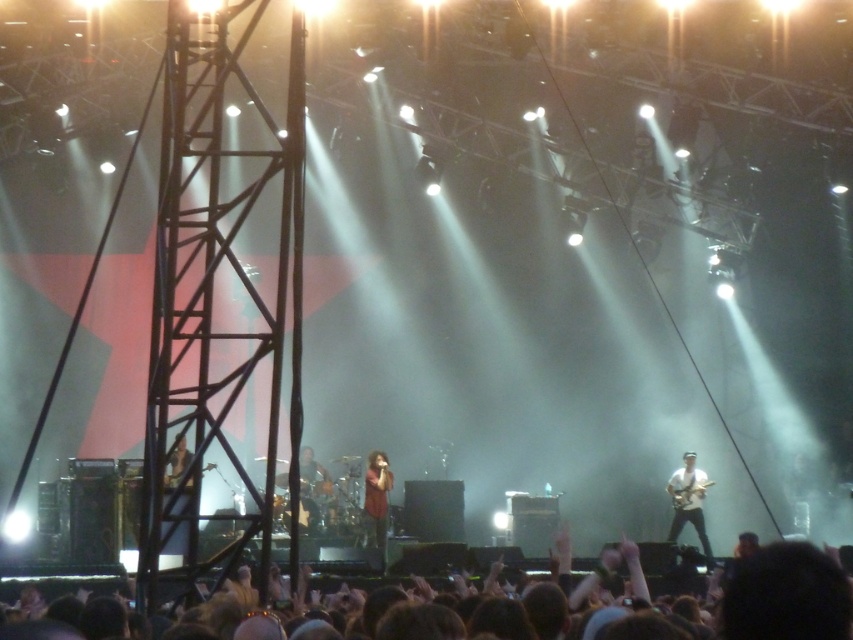
Question: Estimate the real-world distances between objects in this image. Which object is closer to the brown hair at lower center?

Choices:
 (A) white matte guitar at right
 (B) matte brown shirt at center
 (C) metallic silver microphone at left
 (D) glossy wood guitar at right

Answer: (C)

Question: Which point is farther to the camera?

Choices:
 (A) (693, 506)
 (B) (672, 504)

Answer: (B)

Question: Among these points, which one is farthest from the camera?

Choices:
 (A) (96, 628)
 (B) (711, 484)
 (C) (376, 497)

Answer: (B)

Question: Is white matte guitar at right to the right of matte brown shirt at center from the viewer's perspective?

Choices:
 (A) yes
 (B) no

Answer: (A)

Question: Is white matte guitar at right smaller than metallic guitar at lower left?

Choices:
 (A) no
 (B) yes

Answer: (B)

Question: Is shiny black guitar at center further to camera compared to glossy wood guitar at right?

Choices:
 (A) yes
 (B) no

Answer: (B)